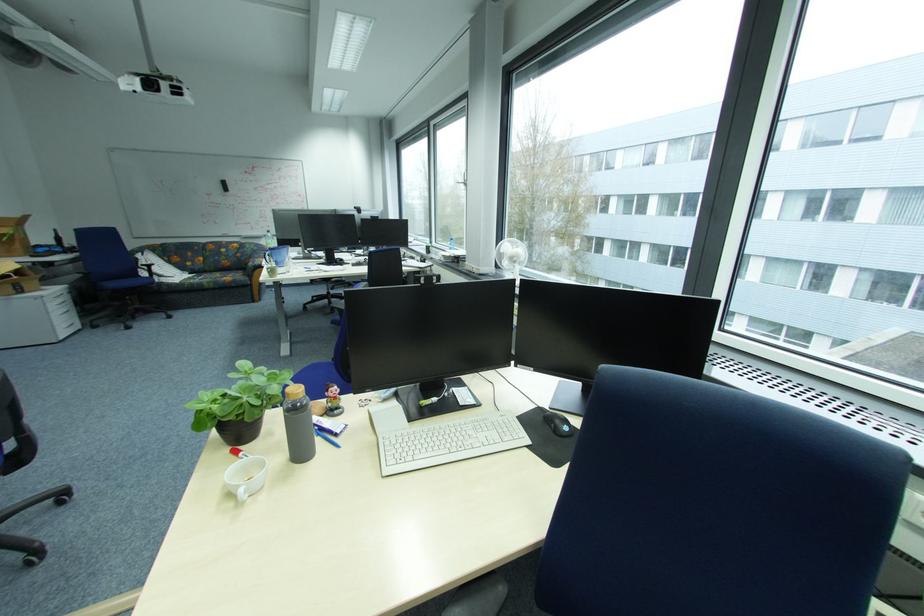
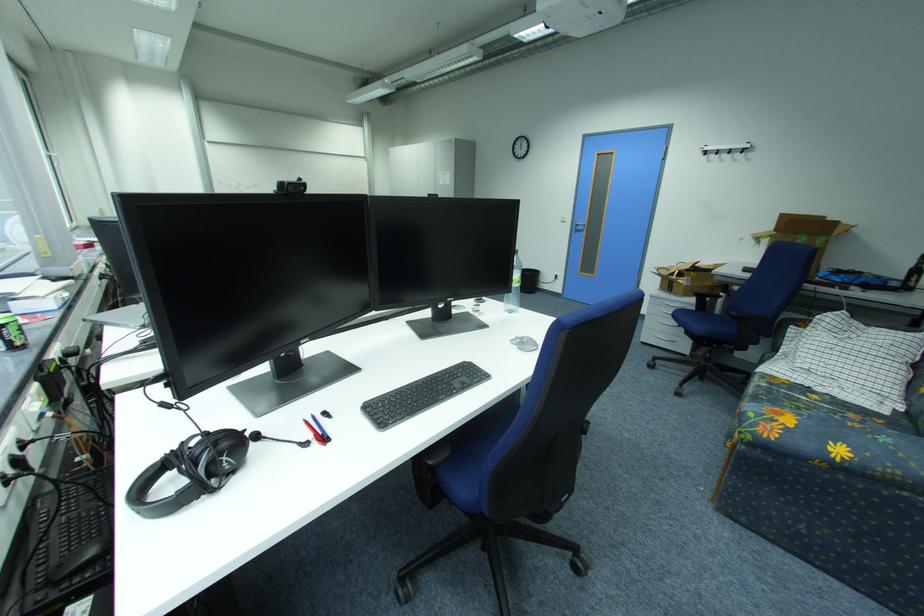
Question: I am providing you with two images of the same scene from different viewpoints. After the viewpoint changes to image2, which objects are now occluded?

Choices:
 (A) black trash can
 (B) computer keyboard
 (C) small figurine
 (D) chair sitting surface

Answer: (B)